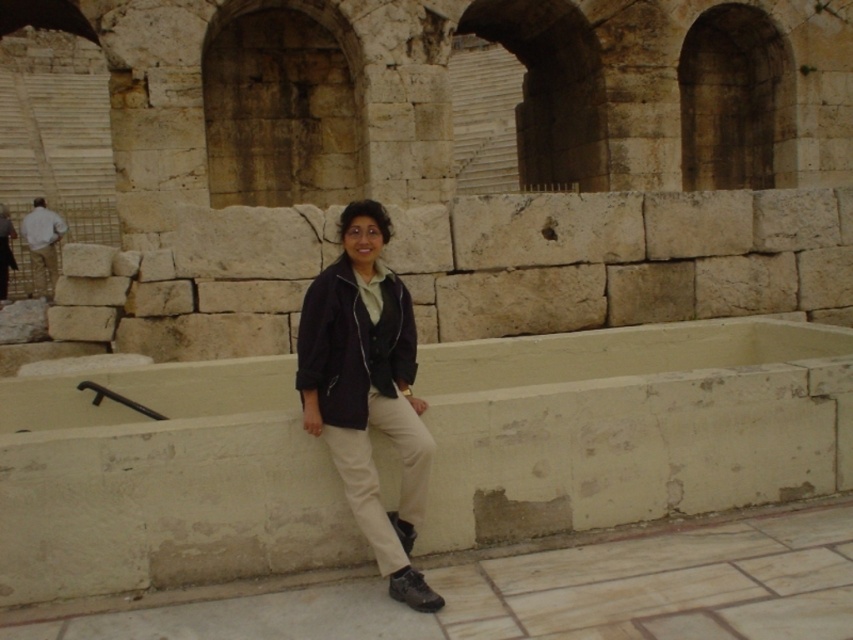
Question: Which point is farther from the camera taking this photo?

Choices:
 (A) (25, 227)
 (B) (12, 228)
 (C) (392, 384)

Answer: (B)

Question: Which point is closer to the camera?

Choices:
 (A) dark blue jacket at center
 (B) matte black jacket at center
 (C) light brown leather pants at left

Answer: (A)

Question: Is dark blue jacket at center below matte black jacket at center?

Choices:
 (A) no
 (B) yes

Answer: (B)

Question: Is light brown leather pants at left bigger than matte black jacket at center?

Choices:
 (A) yes
 (B) no

Answer: (B)

Question: Does light brown leather pants at left have a smaller size compared to matte black jacket at center?

Choices:
 (A) no
 (B) yes

Answer: (B)

Question: Which point is closer to the camera?

Choices:
 (A) light brown leather pants at left
 (B) dark blue jacket at center

Answer: (B)